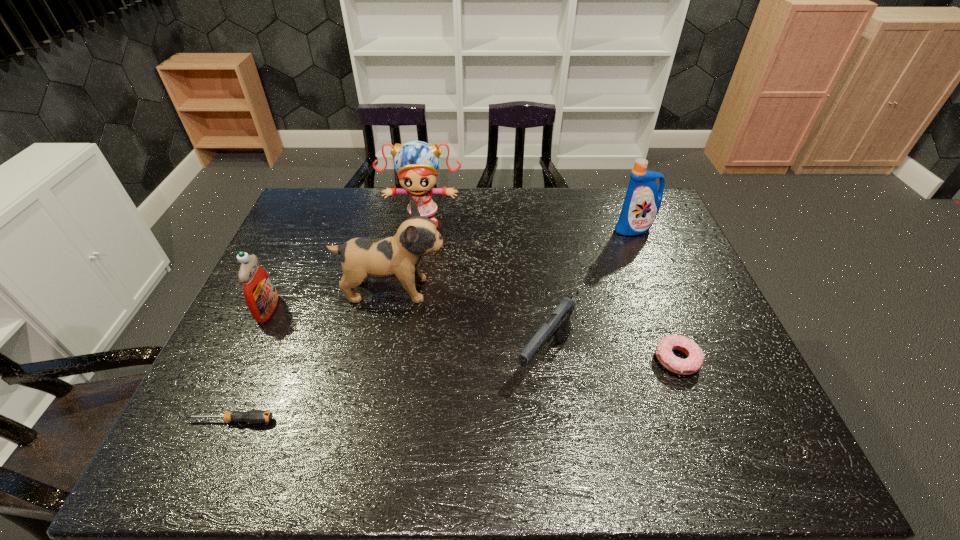
Where is `free point between the right detergent and the nearer detergent`? The width and height of the screenshot is (960, 540). free point between the right detergent and the nearer detergent is located at coordinates (451, 269).

The width and height of the screenshot is (960, 540). I want to click on empty space between the shortest object and the shorter detergent, so click(x=250, y=364).

Find the location of a particular element. free space between the taller detergent and the gun is located at coordinates (589, 294).

The width and height of the screenshot is (960, 540). Identify the location of vacant area that lies between the puppy and the fourth tallest object. (330, 300).

Locate an element on the screen. This screenshot has height=540, width=960. vacant area that lies between the doll and the sixth tallest object is located at coordinates (549, 289).

Locate an element on the screen. This screenshot has width=960, height=540. free space between the nearer detergent and the fifth tallest object is located at coordinates (406, 334).

This screenshot has height=540, width=960. Find the location of `free space between the doll and the gun`. free space between the doll and the gun is located at coordinates (484, 289).

Where is `free spot between the third shortest object and the farther detergent`? The width and height of the screenshot is (960, 540). free spot between the third shortest object and the farther detergent is located at coordinates (589, 294).

Identify the location of vacant space that is in between the third shortest object and the nearest object. This screenshot has width=960, height=540. (388, 390).

Identify the location of the fifth closest object to the left detergent. The height and width of the screenshot is (540, 960). (695, 357).